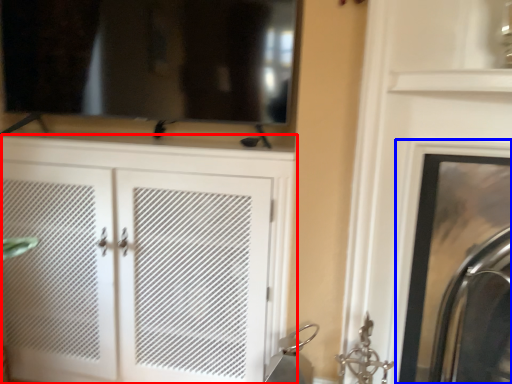
Question: Which object appears farthest to the camera in this image, cupboard (highlighted by a red box) or fireplace (highlighted by a blue box)?

Choices:
 (A) cupboard
 (B) fireplace

Answer: (A)